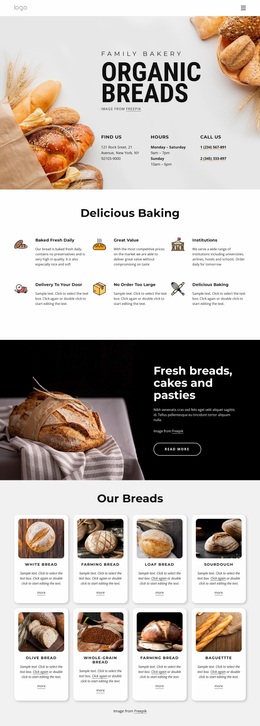
Where is `box`? Image resolution: width=260 pixels, height=726 pixels. box is located at coordinates (68, 698).